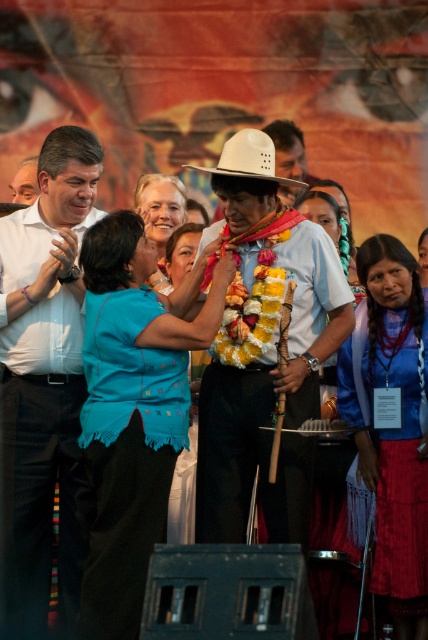
Which is below, white matte hat at center or white matte cowboy hat at center?

Positioned lower is white matte hat at center.

Is point (315, 378) behind point (269, 141)?

That is True.

Locate an element on the screen. This screenshot has height=640, width=428. white matte hat at center is located at coordinates (264, 353).

Can you confirm if blue fringed blouse at center is bigger than matte white shirt at center?

No.

Does blue fringed blouse at center have a lesser height compared to matte white shirt at center?

No.

What do you see at coordinates (133, 410) in the screenshot?
I see `blue fringed blouse at center` at bounding box center [133, 410].

I want to click on blue fringed blouse at center, so click(x=133, y=410).

From the picture: Which is above, white shirt at left or velvet blue blouse at center?

Positioned higher is white shirt at left.

Can you confirm if white shirt at left is taller than velvet blue blouse at center?

Yes, white shirt at left is taller than velvet blue blouse at center.

This screenshot has height=640, width=428. I want to click on white shirt at left, so click(45, 374).